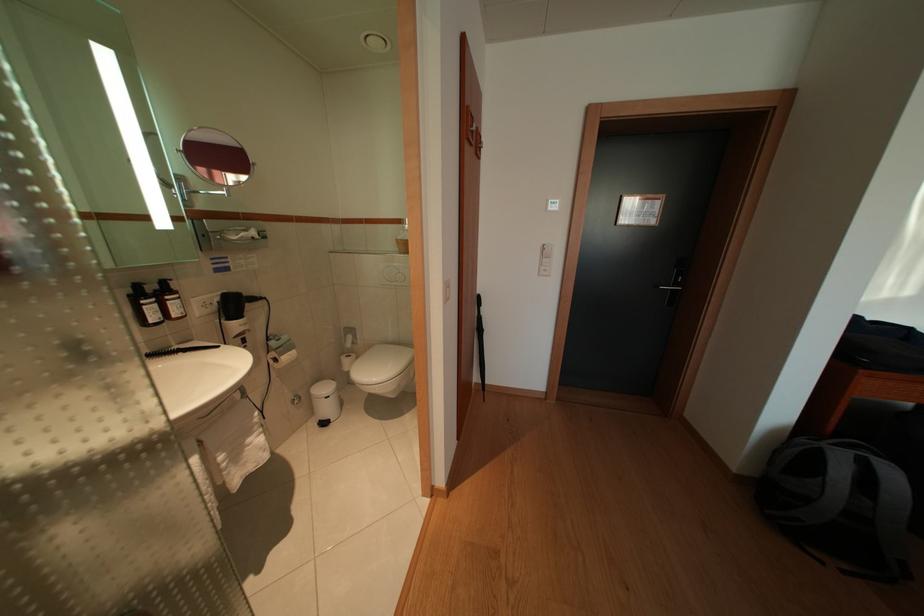
The image size is (924, 616). Identify the location of trash can pedal. (326, 406).